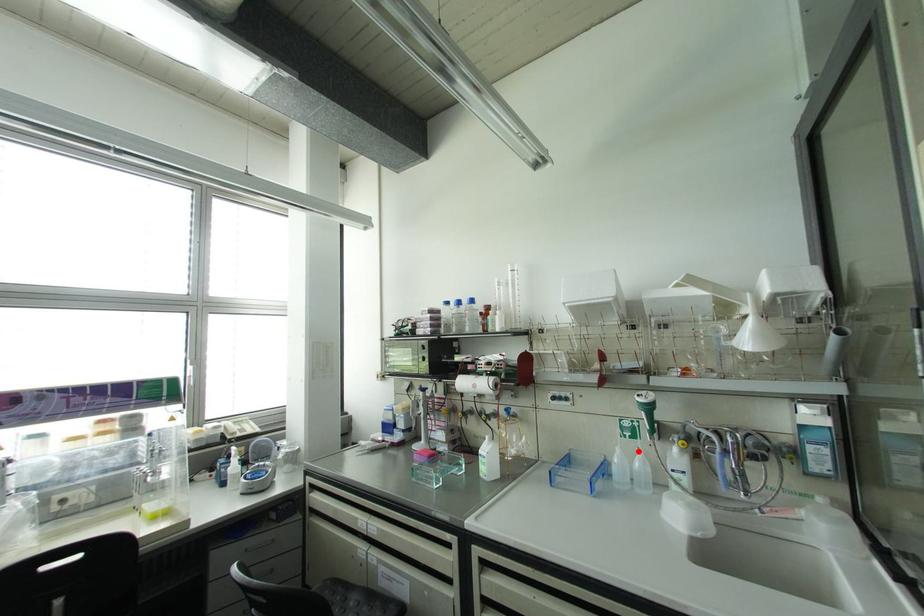
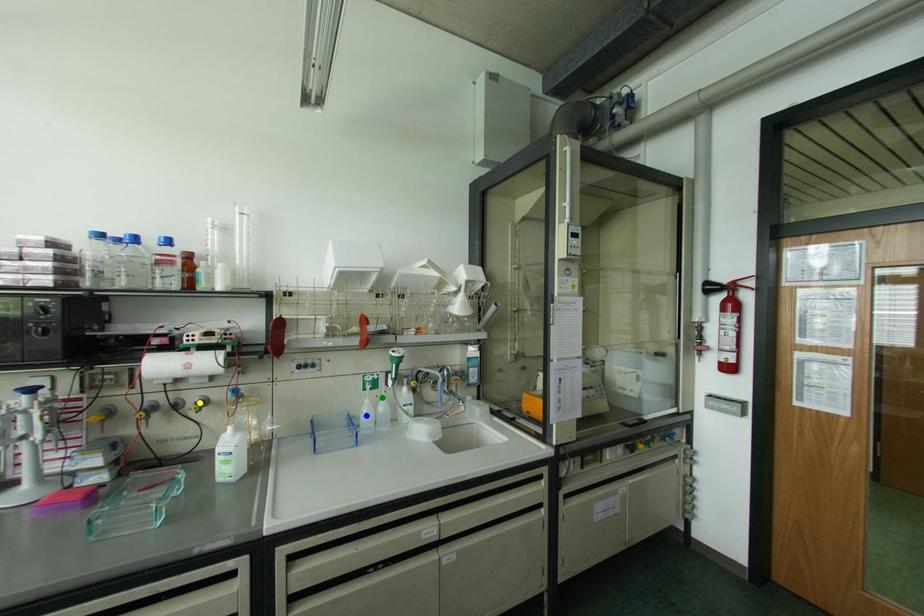
Question: I am providing you with two images of the same scene from different viewpoints. A red point is marked on the first image. You are given multiple points on the second image. Can you choose the point in image 2 that corresponds to the point in image 1?

Choices:
 (A) green point
 (B) blue point
 (C) yellow point

Answer: (A)